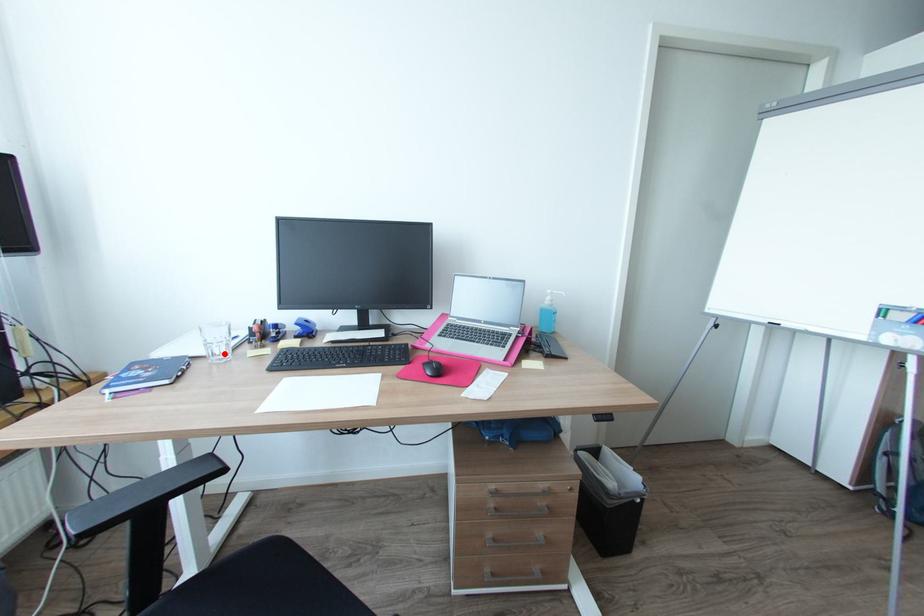
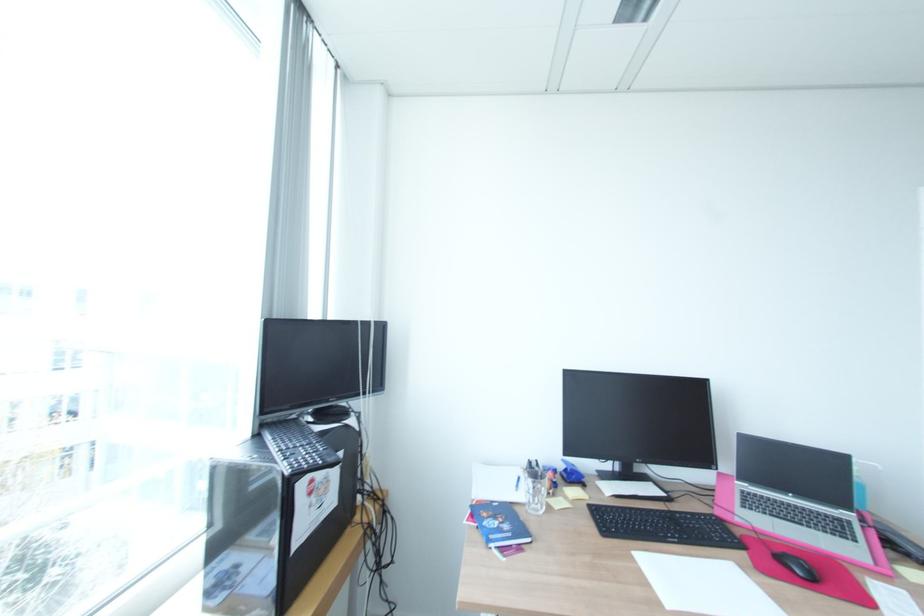
Question: I am providing you with two images of the same scene from different viewpoints. In image1, a red point is highlighted. Considering the same 3D point in image2, which of the following is correct?

Choices:
 (A) It is closer
 (B) It is farther

Answer: (B)